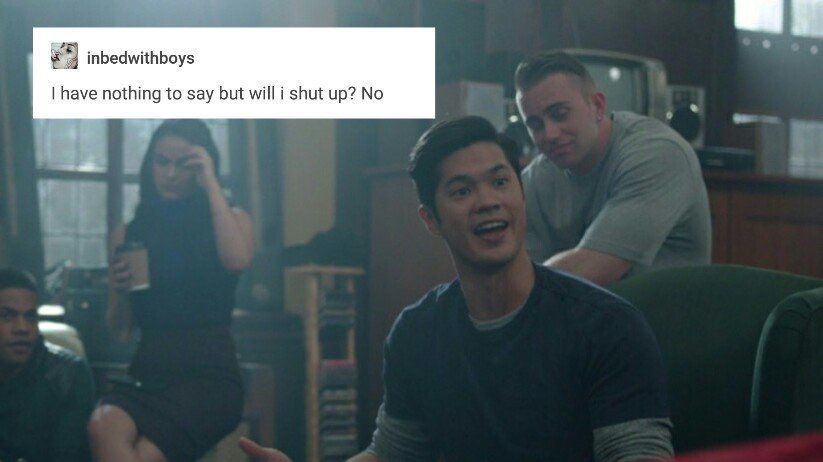
Where is `wooden dresser`? Image resolution: width=823 pixels, height=462 pixels. wooden dresser is located at coordinates (770, 228).